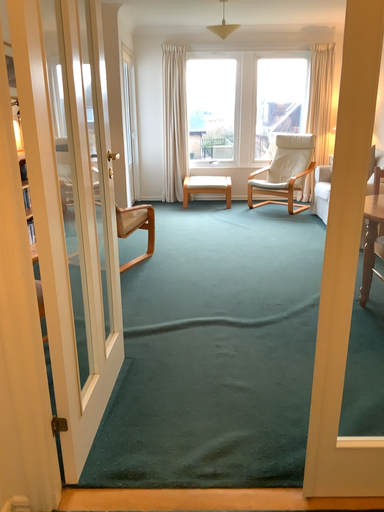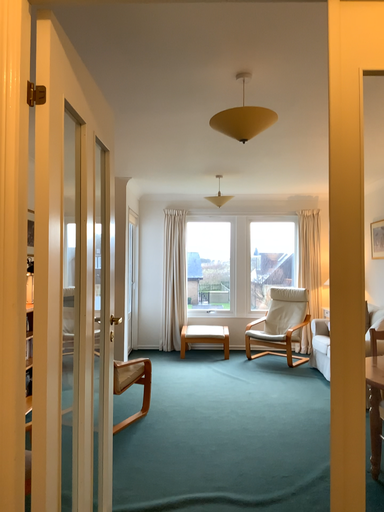
Question: Which way did the camera rotate in the video?

Choices:
 (A) rotated downward
 (B) rotated upward

Answer: (B)